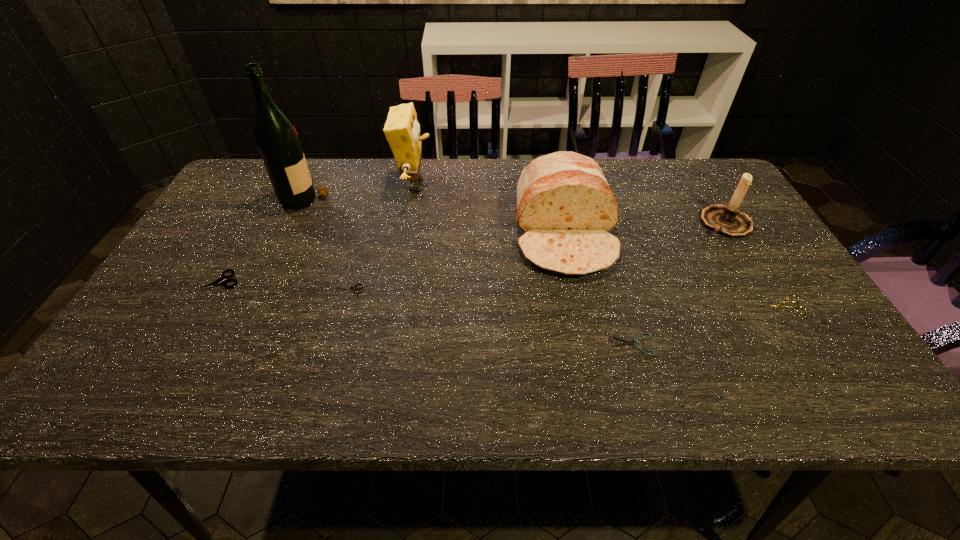
Identify the location of wine bottle. Image resolution: width=960 pixels, height=540 pixels. (277, 140).

I want to click on the seventh shortest object, so click(402, 131).

The image size is (960, 540). I want to click on sponge, so click(x=402, y=131).

Find the location of a particular element. candle holder is located at coordinates (727, 220).

At what (x,y) coordinates should I click in order to perform the action: click on bread. Please return your answer as a coordinate pair (x, y). The width and height of the screenshot is (960, 540). Looking at the image, I should click on (565, 206).

The height and width of the screenshot is (540, 960). What are the coordinates of `the tallest shears` in the screenshot? It's located at 219,281.

The height and width of the screenshot is (540, 960). What are the coordinates of `the leftmost shears` in the screenshot? It's located at (219, 281).

Image resolution: width=960 pixels, height=540 pixels. What are the coordinates of `the second nearest shears` in the screenshot? It's located at click(780, 305).

I want to click on the rightmost shears, so click(780, 305).

Identify the location of the second shears from left to right. The image size is (960, 540). (355, 287).